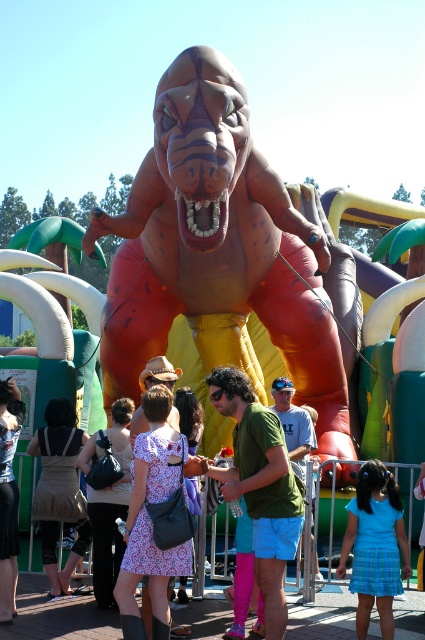
The width and height of the screenshot is (425, 640). What do you see at coordinates (374, 547) in the screenshot? I see `blue plaid skirt at lower center` at bounding box center [374, 547].

Is point (379, 625) positioned behind point (64, 593)?

No, it is not.

Between point (376, 588) and point (73, 480), which one is positioned behind?

The point (73, 480) is more distant.

The image size is (425, 640). Identify the location of blue plaid skirt at lower center. (374, 547).